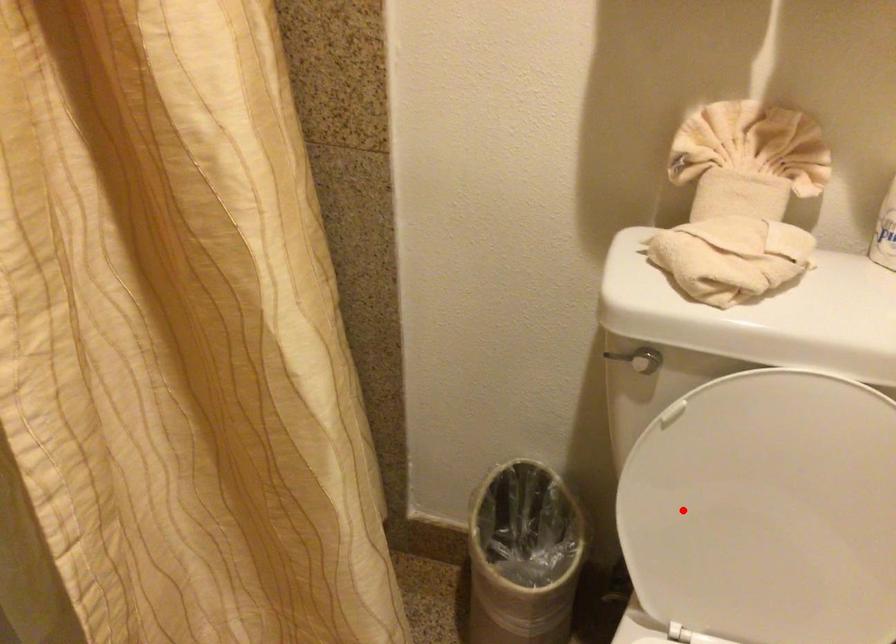
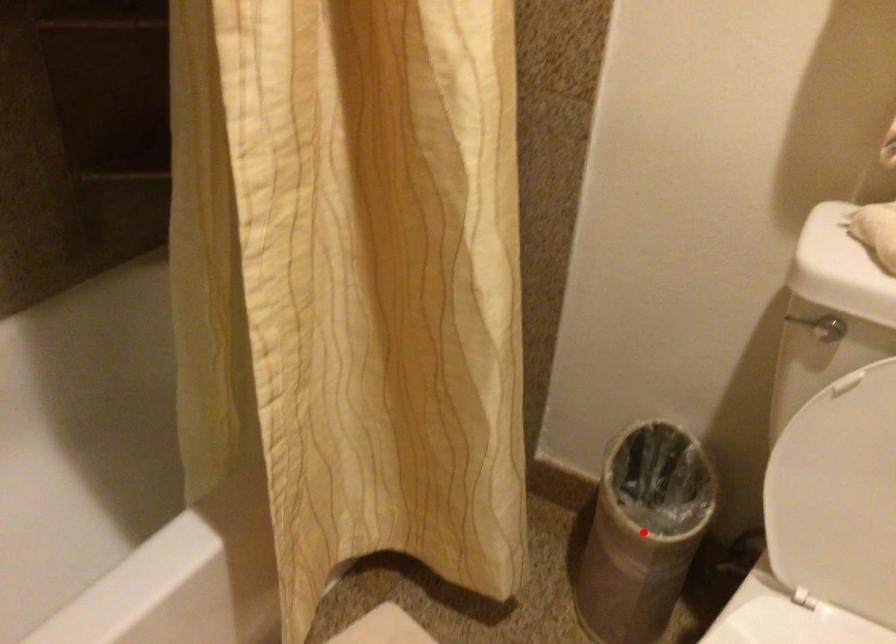
I am providing you with two images of the same scene from different viewpoints. A red point is marked on the first image and another point is marked on the second image. Is the red point in image1 aligned with the point shown in image2?

No